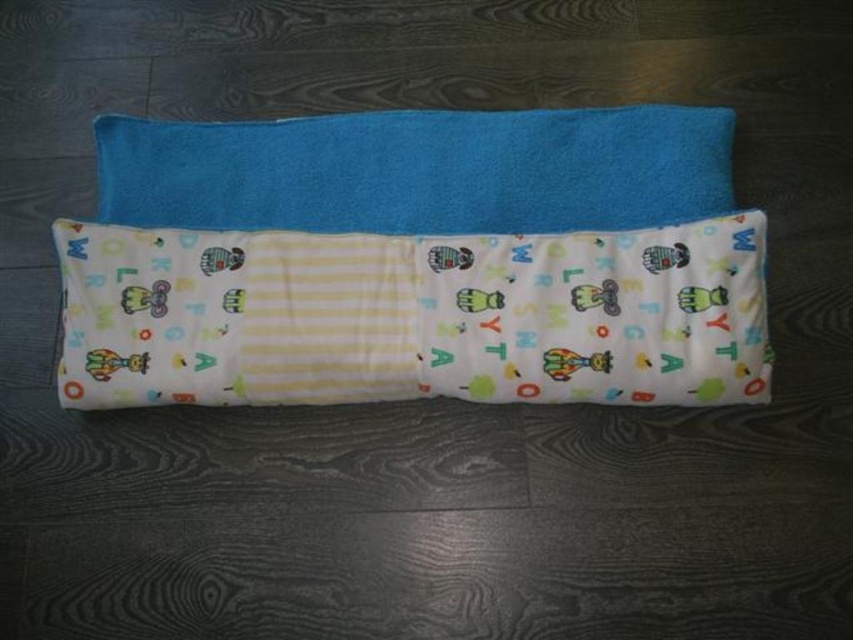
Question: Which of the following is the farthest from the observer?

Choices:
 (A) (144, 401)
 (B) (654, 156)

Answer: (B)

Question: Where is white cotton blanket at center located in relation to blue soft towel at center in the image?

Choices:
 (A) above
 (B) below

Answer: (B)

Question: Among these objects, which one is farthest from the camera?

Choices:
 (A) blue soft towel at center
 (B) white cotton blanket at center

Answer: (A)

Question: Is white cotton blanket at center below blue soft towel at center?

Choices:
 (A) yes
 (B) no

Answer: (A)

Question: Which point is closer to the camera?

Choices:
 (A) white cotton blanket at center
 (B) blue soft towel at center

Answer: (A)

Question: Does white cotton blanket at center have a larger size compared to blue soft towel at center?

Choices:
 (A) yes
 (B) no

Answer: (A)